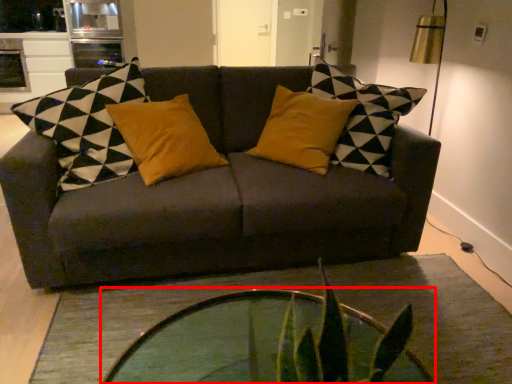
Question: From the image's perspective, what is the correct spatial relationship of coffee table (annotated by the red box) in relation to studio couch?

Choices:
 (A) above
 (B) below

Answer: (B)